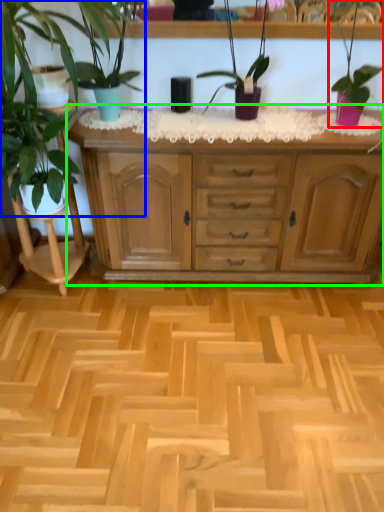
Question: Estimate the real-world distances between objects in this image. Which object is closer to houseplant (highlighted by a red box), houseplant (highlighted by a blue box) or chest of drawers (highlighted by a green box)?

Choices:
 (A) houseplant
 (B) chest of drawers

Answer: (B)